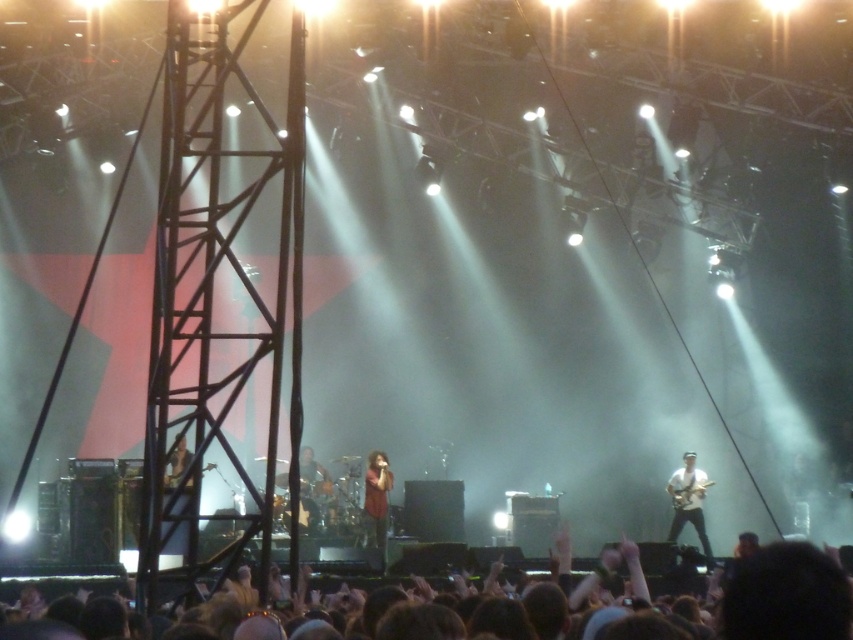
You are a photographer at the concert and want to capture a closeup of both the brown hair at lower center and the shiny black guitar at center. Which object should you zoom in on first to ensure it fills the frame properly?

The brown hair at lower center has a larger size compared to the shiny black guitar at center, so you should zoom in on the brown hair at lower center first to ensure it fills the frame properly.

You are a stagehand setting up equipment and need to place a new amplifier next to the white matte guitar at right and the metallic guitar at lower left. Which guitar requires more space horizontally for the amplifier?

The metallic guitar at lower left requires more horizontal space because it has a greater width than the white matte guitar at right.